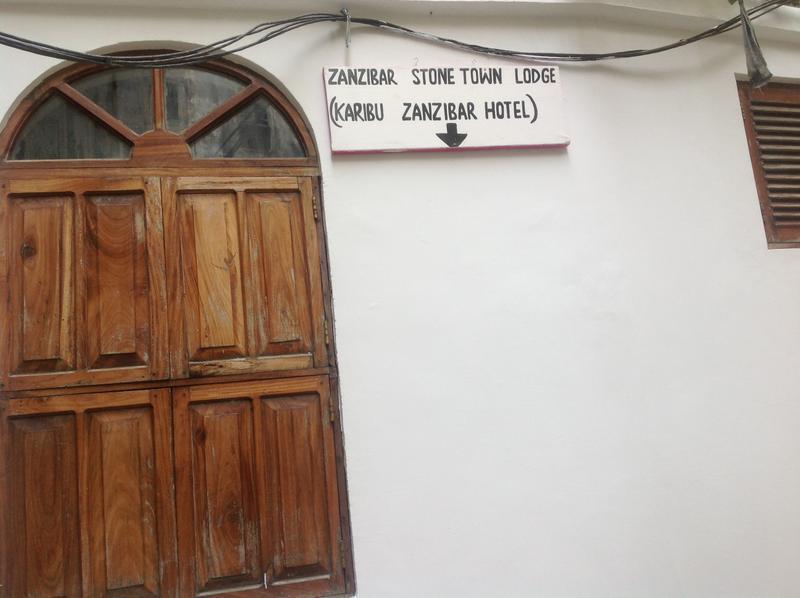
Where is `gray hanging rag`? The height and width of the screenshot is (598, 800). gray hanging rag is located at coordinates (752, 44).